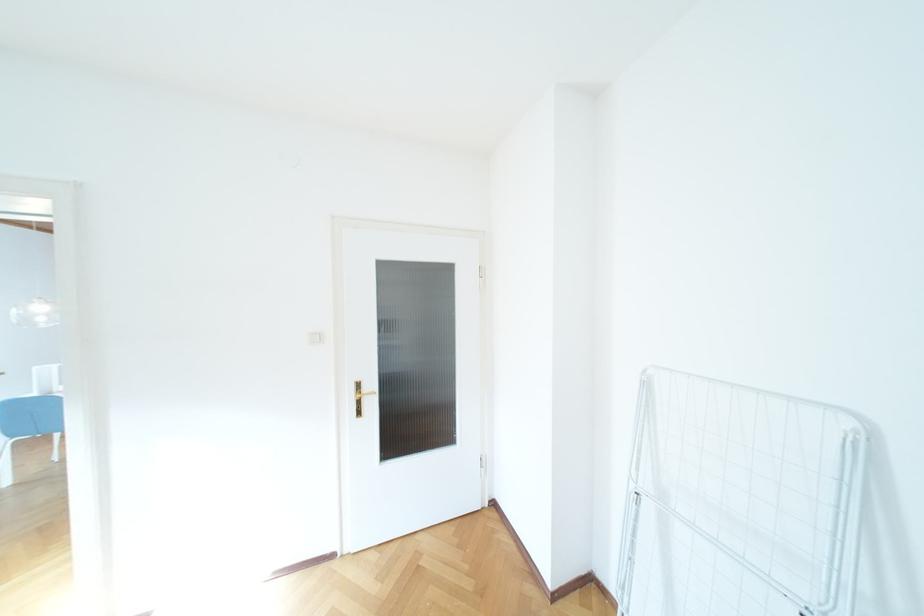
Image resolution: width=924 pixels, height=616 pixels. In order to click on gold door handle in this screenshot , I will do `click(363, 394)`.